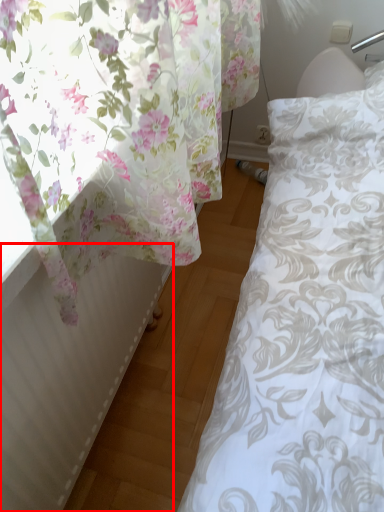
Question: Where is radiator (annotated by the red box) located in relation to curtain in the image?

Choices:
 (A) left
 (B) right

Answer: (B)